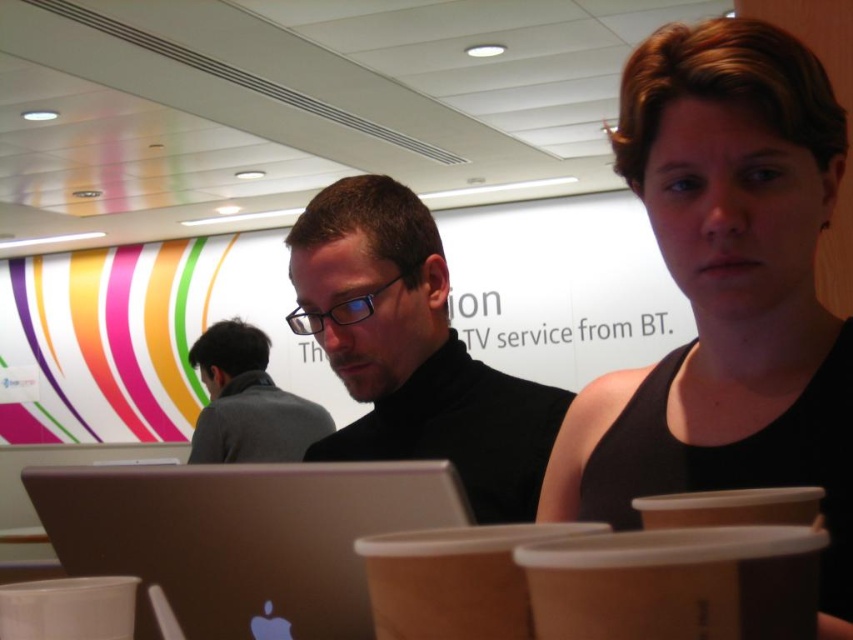
Question: Which of the following is the farthest from the observer?

Choices:
 (A) (572, 435)
 (B) (511, 428)
 (C) (28, 614)
 (D) (281, 410)

Answer: (D)

Question: Can you confirm if black tank top at center is bigger than black matte turtleneck at center?

Choices:
 (A) no
 (B) yes

Answer: (A)

Question: Based on their relative distances, which object is farther from the black matte turtleneck at center?

Choices:
 (A) brown paper cup at lower left
 (B) gray wool sweater at center
 (C) satin silver laptop at lower left
 (D) black tank top at center

Answer: (B)

Question: Which point is closer to the camera?

Choices:
 (A) (403, 248)
 (B) (219, 412)

Answer: (A)

Question: Is black matte turtleneck at center positioned at the back of gray wool sweater at center?

Choices:
 (A) yes
 (B) no

Answer: (B)

Question: From the image, what is the correct spatial relationship of black tank top at center in relation to black matte turtleneck at center?

Choices:
 (A) above
 (B) below

Answer: (A)